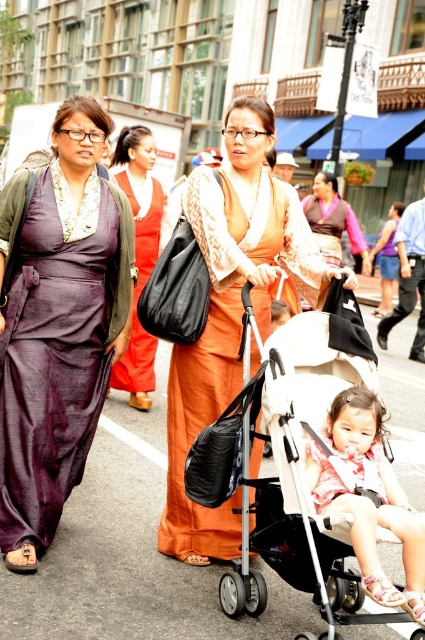
Question: Can you confirm if orange satin dress at center is positioned to the left of purple silk monk at center?

Choices:
 (A) no
 (B) yes

Answer: (B)

Question: Does orange satin dress at center have a larger size compared to purple silk monk at center?

Choices:
 (A) yes
 (B) no

Answer: (A)

Question: Estimate the real-world distances between objects in this image. Which object is closer to the matte orange dress at center?

Choices:
 (A) matte purple dress at left
 (B) purple silk monk at center
 (C) purple silk dress at left

Answer: (B)

Question: Among these objects, which one is farthest from the camera?

Choices:
 (A) matte pink dress at center
 (B) matte orange dress at center
 (C) purple silk monk at center

Answer: (C)

Question: Observing the image, what is the correct spatial positioning of orange satin dress at center in reference to matte pink dress at center?

Choices:
 (A) right
 (B) left

Answer: (B)

Question: Among these points, which one is nearest to the camera?

Choices:
 (A) (413, 211)
 (B) (178, 449)
 (C) (308, 205)
 (D) (354, 429)

Answer: (D)